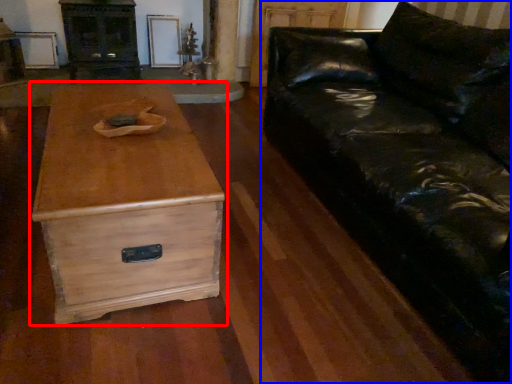
Question: Which object is further to the camera taking this photo, chest of drawers (highlighted by a red box) or studio couch (highlighted by a blue box)?

Choices:
 (A) chest of drawers
 (B) studio couch

Answer: (A)